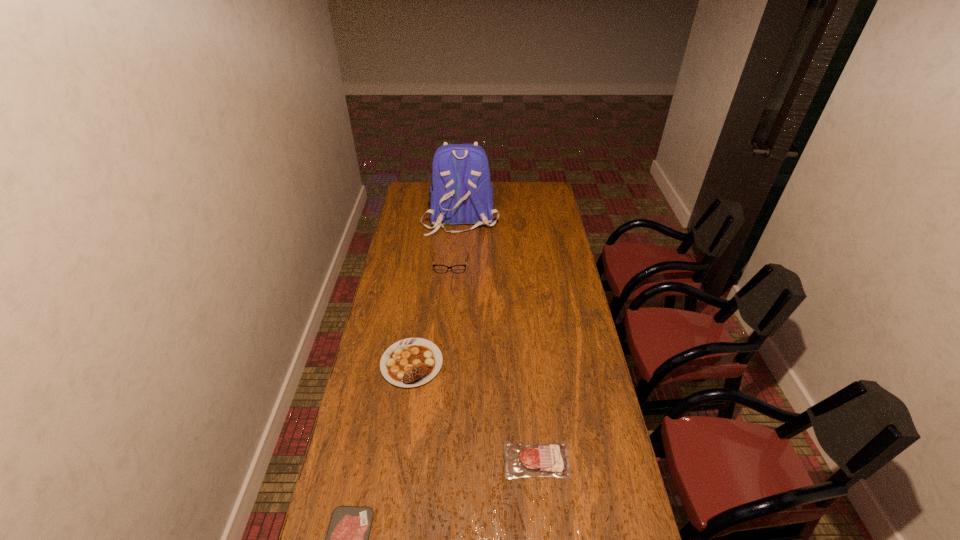
Find the location of a particular element. This screenshot has width=960, height=540. blank space at the far right corner of the desktop is located at coordinates coord(534,197).

Where is `empty space between the farthest steak and the backpack`? empty space between the farthest steak and the backpack is located at coordinates (436, 291).

In order to click on empty space that is in between the spectacles and the tallest object in this screenshot , I will do `click(456, 241)`.

You are a GUI agent. You are given a task and a screenshot of the screen. Output one action in this format:
    pyautogui.click(x=<x>, y=<y>)
    Task: Click on the free space between the tallest object and the spectacles
    Image resolution: width=960 pixels, height=540 pixels.
    Given the screenshot: What is the action you would take?
    pyautogui.click(x=456, y=241)

Identify the location of free space between the third nearest object and the rightmost steak. (474, 411).

At what (x,y) coordinates should I click in order to perform the action: click on vacant space that is in between the tallest object and the farthest steak. Please return your answer as a coordinate pair (x, y). The image size is (960, 540). Looking at the image, I should click on (436, 291).

At what (x,y) coordinates should I click in order to perform the action: click on vacant area between the backpack and the third nearest object. Please return your answer as a coordinate pair (x, y). The image size is (960, 540). Looking at the image, I should click on (436, 291).

Where is `vacant point located between the spectacles and the farthest steak`? vacant point located between the spectacles and the farthest steak is located at coordinates (431, 314).

I want to click on vacant area that lies between the farthest object and the third nearest object, so click(436, 291).

I want to click on object that is the fourth closest to the rightmost steak, so click(x=462, y=193).